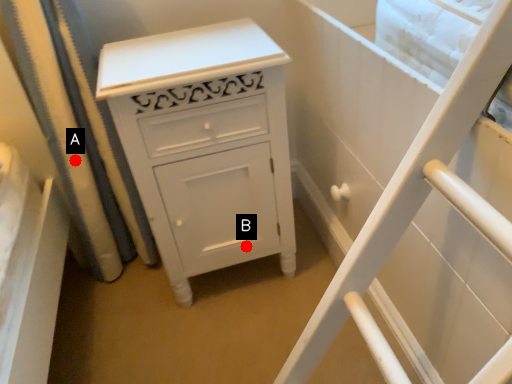
Question: Two points are circled on the image, labeled by A and B beside each circle. Which point is farther from the camera taking this photo?

Choices:
 (A) A is further
 (B) B is further

Answer: (B)